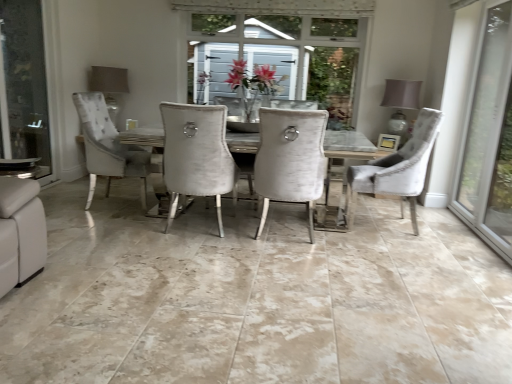
The width and height of the screenshot is (512, 384). Find the location of `free spot to the right of velvet white chair at center, placed as the first chair when sorted from left to right`. free spot to the right of velvet white chair at center, placed as the first chair when sorted from left to right is located at coordinates (352, 242).